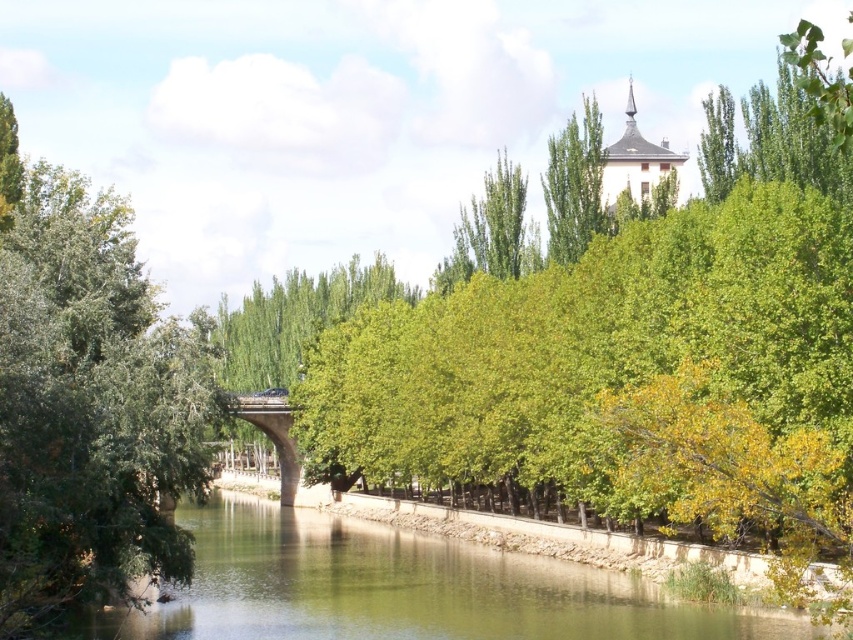
Who is more forward, (548, 154) or (277, 394)?

Point (277, 394) is more forward.

Is green leafy tree at upper center to the right of concrete bridge at center from the viewer's perspective?

Indeed, green leafy tree at upper center is positioned on the right side of concrete bridge at center.

This screenshot has height=640, width=853. I want to click on green leafy tree at upper center, so click(573, 184).

Where is `green leafy tree at upper center`? green leafy tree at upper center is located at coordinates (573, 184).

Does green leafy tree at left appear under green leafy tree at center?

Yes, green leafy tree at left is below green leafy tree at center.

From the picture: Does green leafy tree at left have a larger size compared to green leafy tree at center?

Yes.

Measure the distance between green leafy tree at left and camera.

green leafy tree at left and camera are 46.38 meters apart from each other.

Locate an element on the screen. green leafy tree at left is located at coordinates (90, 406).

You are a GUI agent. You are given a task and a screenshot of the screen. Output one action in this format:
    pyautogui.click(x=<x>, y=<y>)
    Task: Click on the green leafy tree at upper center
    
    Given the screenshot: What is the action you would take?
    pyautogui.click(x=573, y=184)

Does green leafy tree at upper center have a larger size compared to white stucco tower at upper center?

No, green leafy tree at upper center is not bigger than white stucco tower at upper center.

Does point (582, 232) come in front of point (654, 145)?

Yes, point (582, 232) is in front of point (654, 145).

This screenshot has width=853, height=640. Find the location of `green leafy tree at upper center`. green leafy tree at upper center is located at coordinates (573, 184).